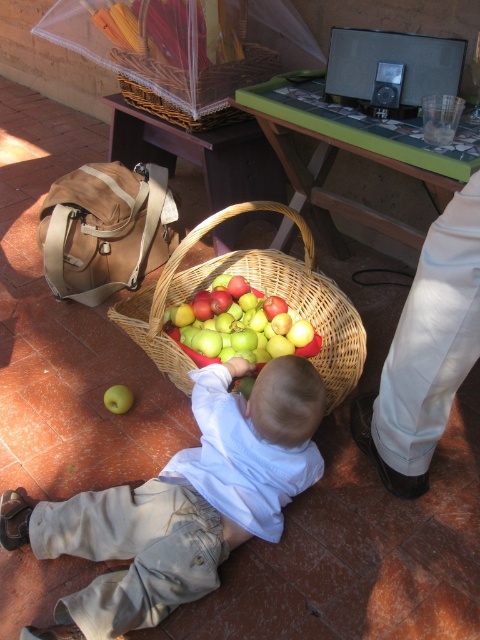
Question: Which is farther from the white cotton pants at lower right?

Choices:
 (A) green matte apple at lower left
 (B) woven wicker basket at lower center
 (C) shiny green apples at center
 (D) light beige cotton pants at lower left

Answer: (A)

Question: Observing the image, what is the correct spatial positioning of light beige cotton pants at lower left in reference to woven brown basket at upper center?

Choices:
 (A) below
 (B) above

Answer: (A)

Question: Which point is farther to the camera?

Choices:
 (A) woven brown basket at upper center
 (B) woven wicker basket at lower center
 (C) light beige cotton pants at lower left

Answer: (A)

Question: Is white cotton pants at lower right to the left of green matte apple at lower left from the viewer's perspective?

Choices:
 (A) yes
 (B) no

Answer: (B)

Question: Is light beige cotton pants at lower left thinner than green matte apple at lower left?

Choices:
 (A) yes
 (B) no

Answer: (B)

Question: Estimate the real-world distances between objects in this image. Which object is farther from the woven brown basket at upper center?

Choices:
 (A) light beige cotton pants at lower left
 (B) white cotton pants at lower right
 (C) woven wicker basket at lower center

Answer: (A)